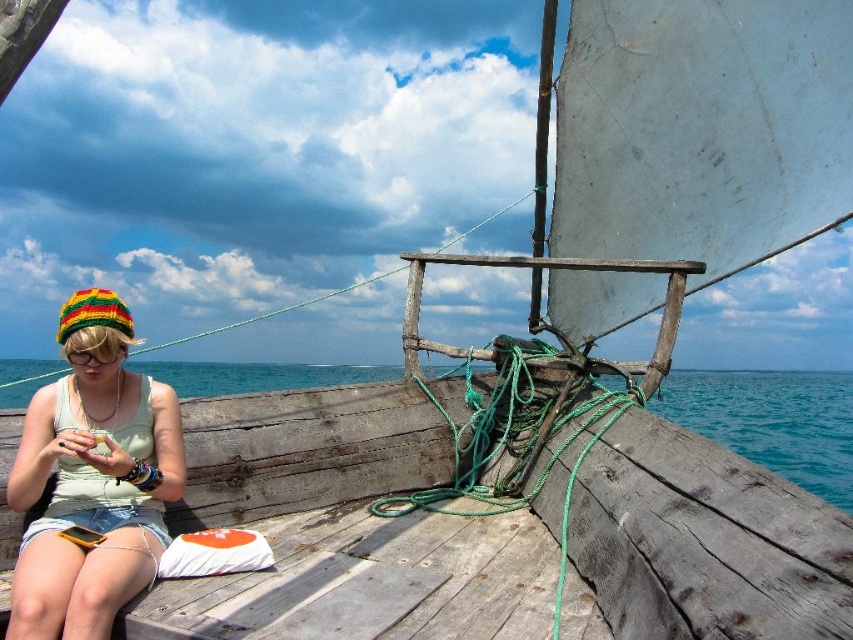
You are standing on the deck of the boat and see the knitted multicolored hat at left and the blue water at lower left. Which object is positioned more to the left side of the scene?

The knitted multicolored hat at left is positioned to the left of the blue water at lower left, so the knitted multicolored hat at left is more to the left.

You are a photographer standing on the deck of the boat. You want to capture a photo of the knitted multicolored hat at left. Where should you position yourself to ensure the hat is centered in your camera viewfinder?

To center the knitted multicolored hat at left in your camera viewfinder, position yourself directly in front of the hat at point (91, 499).